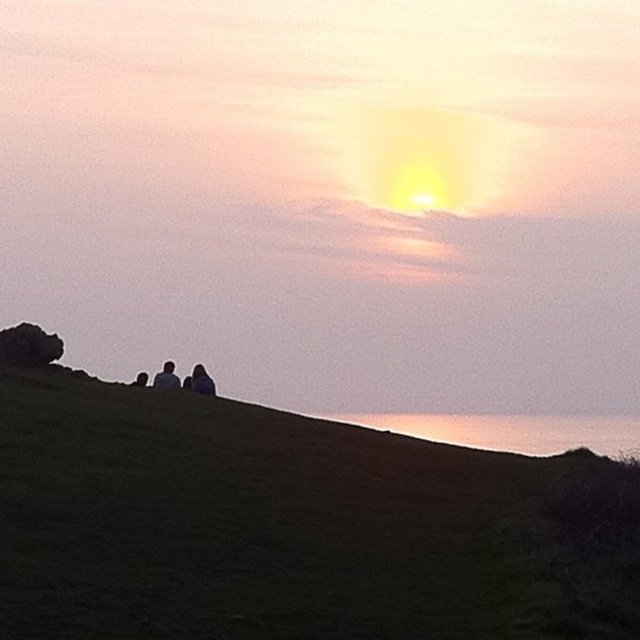
You are planning to place a new decorative item on the grassy hill in the sunset scene. You have two options from the image, the dark blue fabric at center and the dark gray sweater at center. Which one should you choose if you want the item to be more visible against the grass?

The dark blue fabric at center is taller than the dark gray sweater at center, so it will be more visible against the grass.

You are standing on the grassy hill and want to pick up both items. Which item should you reach for first, the dark blue fabric at center or the dark gray sweater at center, based on their positions?

You should reach for the dark blue fabric at center first because it is closer to you than the dark gray sweater at center.